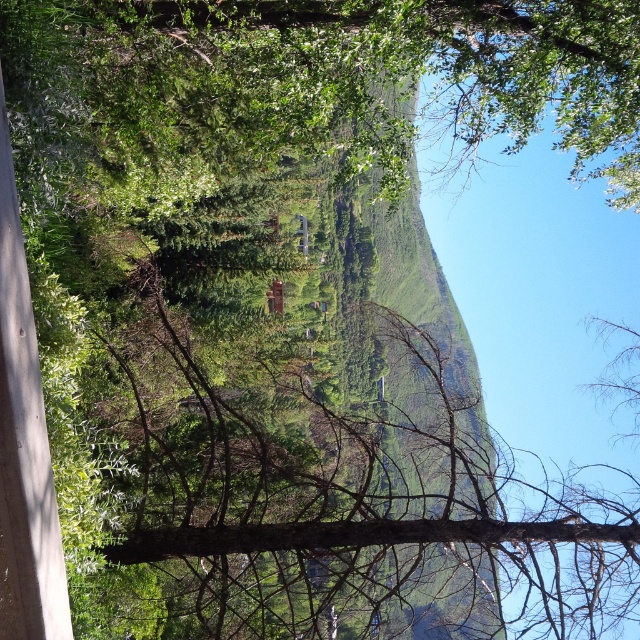
Question: Is matte brown house at center bigger than transparent glass window at center?

Choices:
 (A) yes
 (B) no

Answer: (B)

Question: Does matte brown house at center have a smaller size compared to transparent glass window at center?

Choices:
 (A) yes
 (B) no

Answer: (A)

Question: Which point is farther to the camera?

Choices:
 (A) (304, 243)
 (B) (282, 300)

Answer: (A)

Question: Is matte brown house at center wider than transparent glass window at center?

Choices:
 (A) no
 (B) yes

Answer: (B)